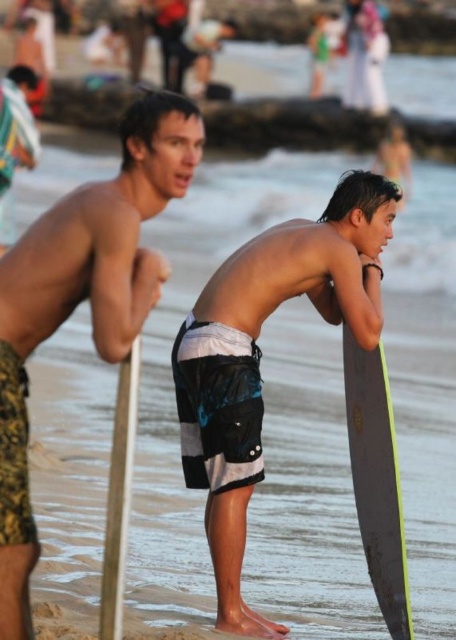
Question: In this image, where is black matte surfboard at center located relative to camouflage-patterned shorts at left?

Choices:
 (A) below
 (B) above

Answer: (A)

Question: Which point is closer to the camera?

Choices:
 (A) matte black surfboard at right
 (B) wooden pole at lower left

Answer: (B)

Question: Among these points, which one is nearest to the camera?

Choices:
 (A) (138, 349)
 (B) (161, 200)
 (C) (315, 275)

Answer: (A)

Question: Which of the following is the farthest from the observer?

Choices:
 (A) matte black surfboard at right
 (B) wooden pole at lower left

Answer: (A)

Question: Is camouflage-patterned shorts at left positioned before wooden pole at lower left?

Choices:
 (A) no
 (B) yes

Answer: (B)

Question: Does camouflage-patterned shorts at left appear under wooden pole at lower left?

Choices:
 (A) yes
 (B) no

Answer: (B)